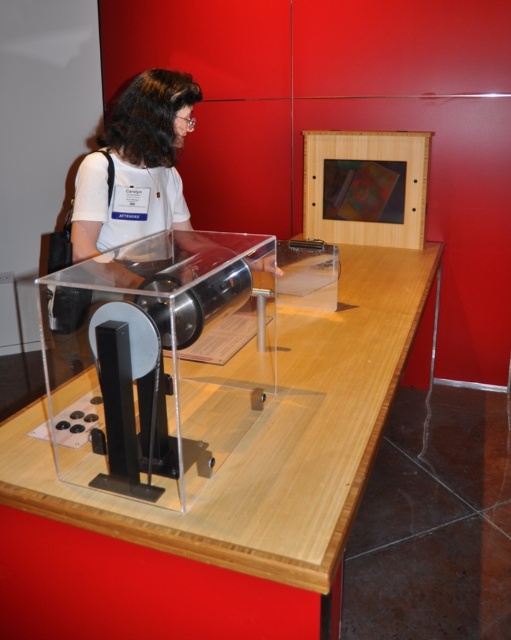
Is point (311, 624) farther from camera compared to point (126, 216)?

No, it is not.

The image size is (511, 640). Find the location of `wooden table at center`. wooden table at center is located at coordinates (224, 492).